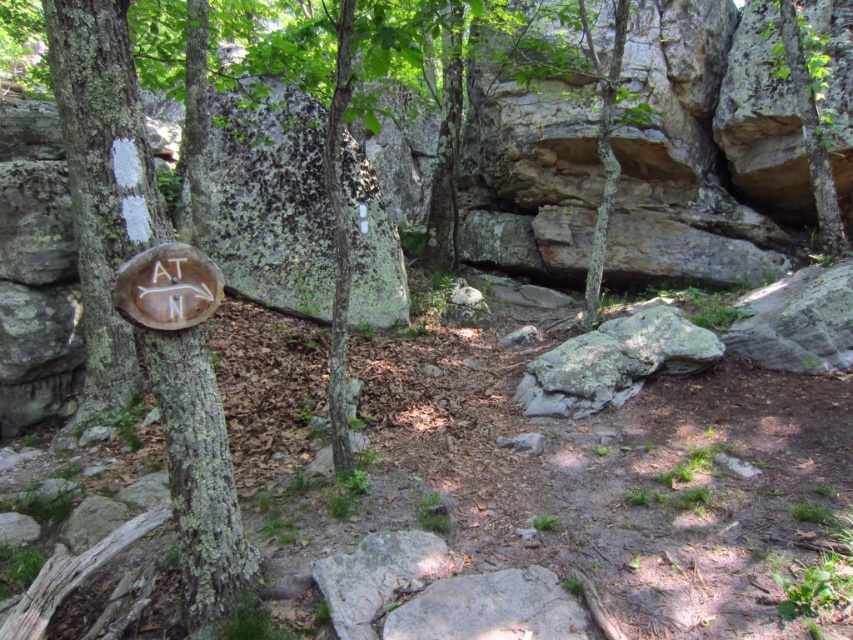
Which is above, brown wood sign at left or green rough bark tree at upper right?

green rough bark tree at upper right is higher up.

Measure the distance between brown wood sign at left and camera.

4.47 feet

Where is `brown wood sign at left`? This screenshot has width=853, height=640. brown wood sign at left is located at coordinates (103, 124).

Consider the image. Is brown wood sign at left positioned before green rough bark at left?

Yes, brown wood sign at left is closer to the viewer.

Does brown wood sign at left have a greater width compared to green rough bark at left?

Correct, the width of brown wood sign at left exceeds that of green rough bark at left.

The height and width of the screenshot is (640, 853). Find the location of `brown wood sign at left`. brown wood sign at left is located at coordinates (103, 124).

This screenshot has width=853, height=640. I want to click on brown wood sign at left, so click(x=103, y=124).

Is point (96, 20) less distant than point (810, 108)?

Yes.

Does green rough bark at left appear on the right side of green rough bark tree at upper right?

Incorrect, green rough bark at left is not on the right side of green rough bark tree at upper right.

This screenshot has width=853, height=640. What are the coordinates of `green rough bark at left` in the screenshot? It's located at (102, 188).